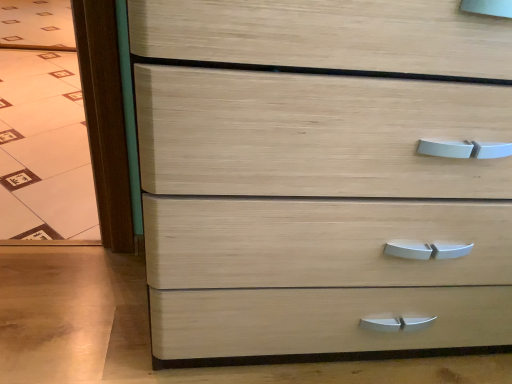
Question: From the image's perspective, is natural wood chest of drawers at center above or below transparent glass door at left?

Choices:
 (A) above
 (B) below

Answer: (B)

Question: Looking at their shapes, would you say natural wood chest of drawers at center is wider or thinner than transparent glass door at left?

Choices:
 (A) wide
 (B) thin

Answer: (B)

Question: In the image, is natural wood chest of drawers at center positioned in front of or behind transparent glass door at left?

Choices:
 (A) front
 (B) behind

Answer: (A)

Question: In terms of height, does transparent glass door at left look taller or shorter compared to natural wood chest of drawers at center?

Choices:
 (A) tall
 (B) short

Answer: (B)

Question: Is transparent glass door at left in front of or behind natural wood chest of drawers at center in the image?

Choices:
 (A) front
 (B) behind

Answer: (B)

Question: Considering the positions of transparent glass door at left and natural wood chest of drawers at center in the image, is transparent glass door at left bigger or smaller than natural wood chest of drawers at center?

Choices:
 (A) small
 (B) big

Answer: (A)

Question: From the image's perspective, is transparent glass door at left above or below natural wood chest of drawers at center?

Choices:
 (A) above
 (B) below

Answer: (A)